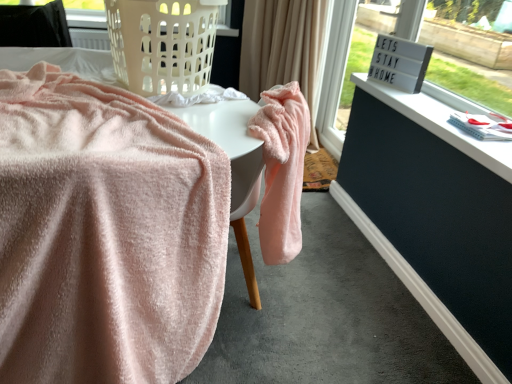
Locate an element on the screen. The image size is (512, 384). free spot in front of velvet pink table at center, which is the 1th table from right to left is located at coordinates (256, 354).